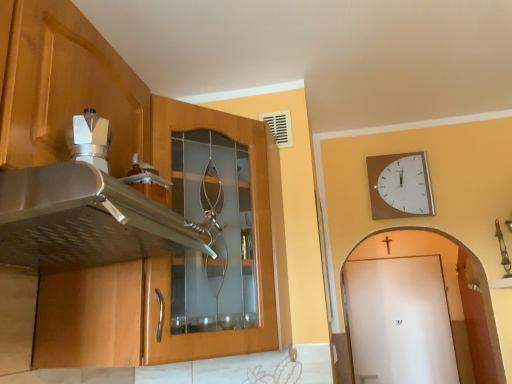
Question: Can you confirm if wooden clock at upper right is bigger than white matte door at right?

Choices:
 (A) no
 (B) yes

Answer: (A)

Question: Is wooden clock at upper right in front of white matte door at right?

Choices:
 (A) yes
 (B) no

Answer: (A)

Question: From a real-world perspective, is wooden clock at upper right located higher than white matte door at right?

Choices:
 (A) yes
 (B) no

Answer: (A)

Question: Is wooden clock at upper right outside of white matte door at right?

Choices:
 (A) no
 (B) yes

Answer: (B)

Question: Is wooden clock at upper right oriented towards white matte door at right?

Choices:
 (A) no
 (B) yes

Answer: (A)

Question: Considering their positions, is white matte door at right located in front of or behind wooden cabinet at left?

Choices:
 (A) front
 (B) behind

Answer: (B)

Question: In terms of width, does white matte door at right look wider or thinner when compared to wooden cabinet at left?

Choices:
 (A) thin
 (B) wide

Answer: (A)

Question: Considering the positions of white matte door at right and wooden cabinet at left in the image, is white matte door at right bigger or smaller than wooden cabinet at left?

Choices:
 (A) big
 (B) small

Answer: (B)

Question: Is point (466, 362) positioned closer to the camera than point (170, 241)?

Choices:
 (A) farther
 (B) closer

Answer: (A)

Question: Relative to wooden cabinet at left, is wooden clock at upper right in front or behind?

Choices:
 (A) behind
 (B) front

Answer: (A)

Question: Is wooden clock at upper right spatially inside wooden cabinet at left, or outside of it?

Choices:
 (A) outside
 (B) inside

Answer: (A)

Question: Is wooden clock at upper right wider or thinner than wooden cabinet at left?

Choices:
 (A) wide
 (B) thin

Answer: (B)

Question: From the image's perspective, is wooden clock at upper right above or below wooden cabinet at left?

Choices:
 (A) above
 (B) below

Answer: (A)

Question: From the image's perspective, relative to white matte door at right, is wooden cabinet at left above or below?

Choices:
 (A) below
 (B) above

Answer: (B)

Question: Considering the positions of point (10, 135) and point (339, 301), is point (10, 135) closer or farther from the camera than point (339, 301)?

Choices:
 (A) farther
 (B) closer

Answer: (B)